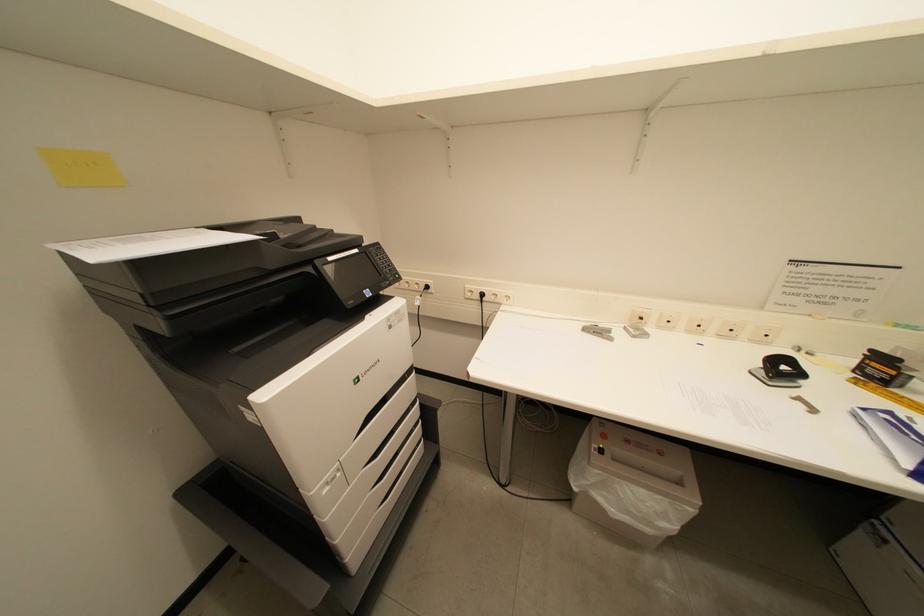
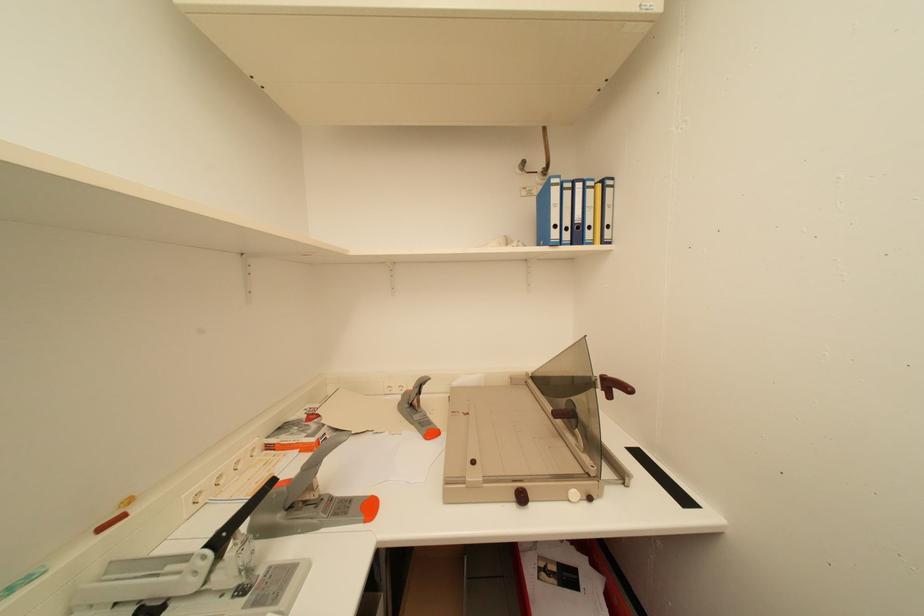
Question: Based on the continuous images, in which direction is the camera rotating? Reply with the corresponding letter.

Choices:
 (A) Left
 (B) Right
 (C) Up
 (D) Down

Answer: (B)